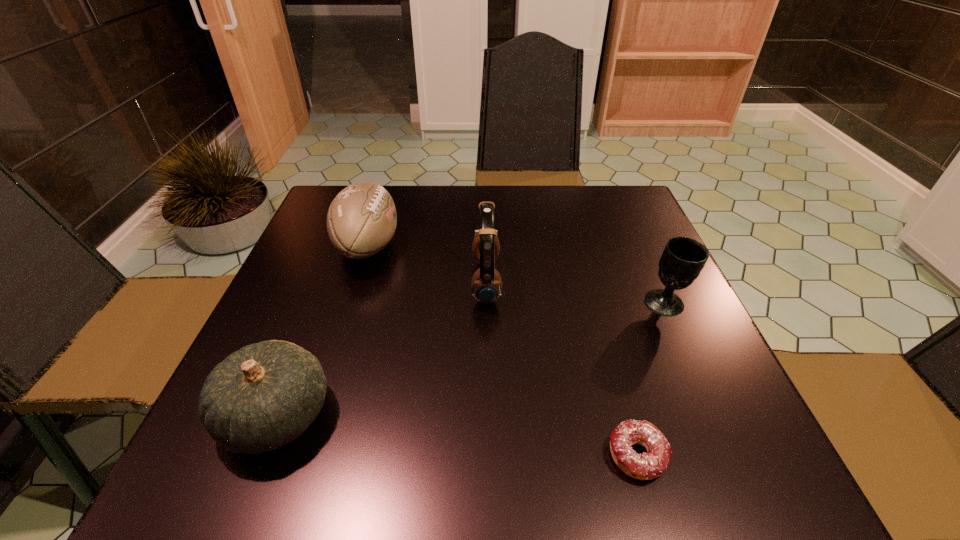
At what (x,y) coordinates should I click in order to perform the action: click on headset. Please return your answer as a coordinate pair (x, y). Image resolution: width=960 pixels, height=540 pixels. Looking at the image, I should click on (486, 284).

This screenshot has width=960, height=540. Find the location of `the tallest object`. the tallest object is located at coordinates (486, 284).

Locate an element on the screen. This screenshot has height=540, width=960. football (American) is located at coordinates 361,220.

The height and width of the screenshot is (540, 960). I want to click on chalice, so click(x=682, y=260).

Locate an element on the screen. This screenshot has width=960, height=540. gourd is located at coordinates (265, 395).

Identify the location of doughnut. (645, 466).

Find the location of `the shortest object`. the shortest object is located at coordinates (645, 466).

This screenshot has height=540, width=960. What are the coordinates of `free space located 0.200m on the ear cup of the headset` in the screenshot? It's located at (383, 282).

Where is `free spot located 0.200m on the ear cup of the headset`? free spot located 0.200m on the ear cup of the headset is located at coordinates (383, 282).

At what (x,y) coordinates should I click in order to perform the action: click on vacant space located on the ear cup of the headset. Please return your answer as a coordinate pair (x, y). The height and width of the screenshot is (540, 960). Looking at the image, I should click on (383, 282).